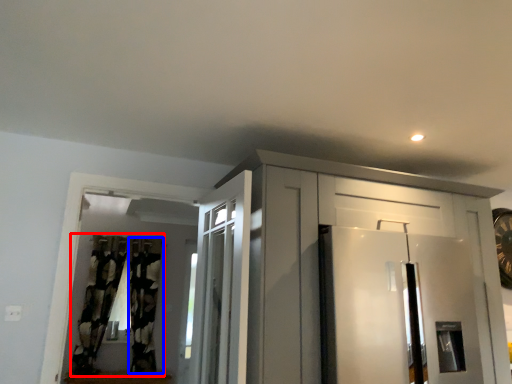
Question: Which point is further to the camera, curtain (highlighted by a red box) or curtain (highlighted by a blue box)?

Choices:
 (A) curtain
 (B) curtain

Answer: (B)